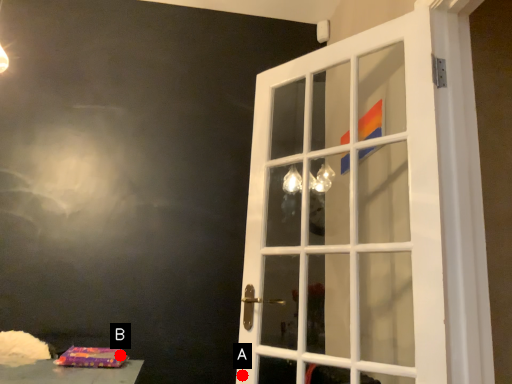
Question: Two points are circled on the image, labeled by A and B beside each circle. Which point appears farthest from the camera in this image?

Choices:
 (A) A is further
 (B) B is further

Answer: (A)